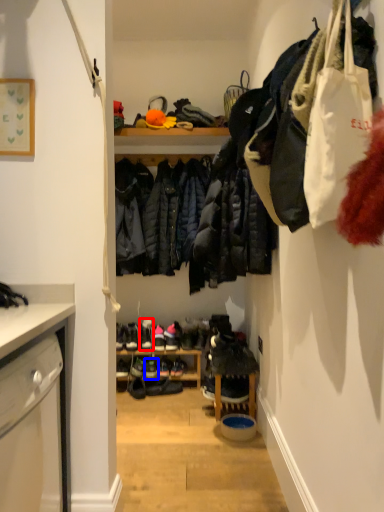
Question: Which object appears farthest to the camera in this image, footwear (highlighted by a red box) or footwear (highlighted by a blue box)?

Choices:
 (A) footwear
 (B) footwear

Answer: (A)